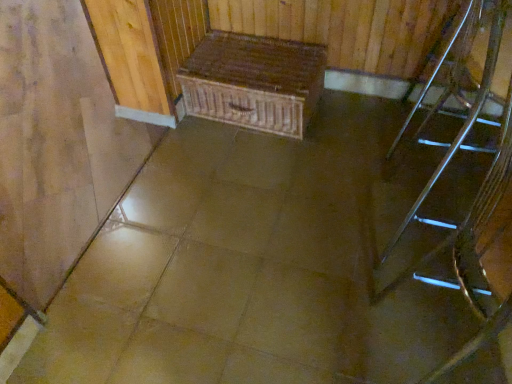
Question: Considering the relative positions of wooden chest at center and metallic silver chair at right in the image provided, is wooden chest at center to the right of metallic silver chair at right from the viewer's perspective?

Choices:
 (A) no
 (B) yes

Answer: (A)

Question: Could you tell me if wooden chest at center is turned towards metallic silver chair at right?

Choices:
 (A) yes
 (B) no

Answer: (B)

Question: Is the depth of wooden chest at center greater than that of metallic silver chair at right?

Choices:
 (A) no
 (B) yes

Answer: (B)

Question: From a real-world perspective, is wooden chest at center beneath metallic silver chair at right?

Choices:
 (A) no
 (B) yes

Answer: (B)

Question: Is wooden chest at center at the left side of metallic silver chair at right?

Choices:
 (A) yes
 (B) no

Answer: (A)

Question: Relative to wooden chest at center, is metallic silver stairs at right in front or behind?

Choices:
 (A) front
 (B) behind

Answer: (A)

Question: From a real-world perspective, is metallic silver stairs at right above or below wooden chest at center?

Choices:
 (A) above
 (B) below

Answer: (A)

Question: Visually, is metallic silver stairs at right positioned to the left or to the right of wooden chest at center?

Choices:
 (A) right
 (B) left

Answer: (A)

Question: Looking at their shapes, would you say metallic silver stairs at right is wider or thinner than wooden chest at center?

Choices:
 (A) wide
 (B) thin

Answer: (B)

Question: Looking at the image, does metallic silver stairs at right seem bigger or smaller compared to metallic silver chair at right?

Choices:
 (A) big
 (B) small

Answer: (A)

Question: Is metallic silver stairs at right to the left or to the right of metallic silver chair at right in the image?

Choices:
 (A) right
 (B) left

Answer: (B)

Question: Is point (502, 225) positioned closer to the camera than point (477, 13)?

Choices:
 (A) farther
 (B) closer

Answer: (B)

Question: From the image's perspective, is metallic silver stairs at right above or below metallic silver chair at right?

Choices:
 (A) above
 (B) below

Answer: (B)

Question: Is metallic silver chair at right spatially inside wooden chest at center, or outside of it?

Choices:
 (A) outside
 (B) inside

Answer: (A)

Question: Is point (463, 110) closer or farther from the camera than point (257, 76)?

Choices:
 (A) closer
 (B) farther

Answer: (B)